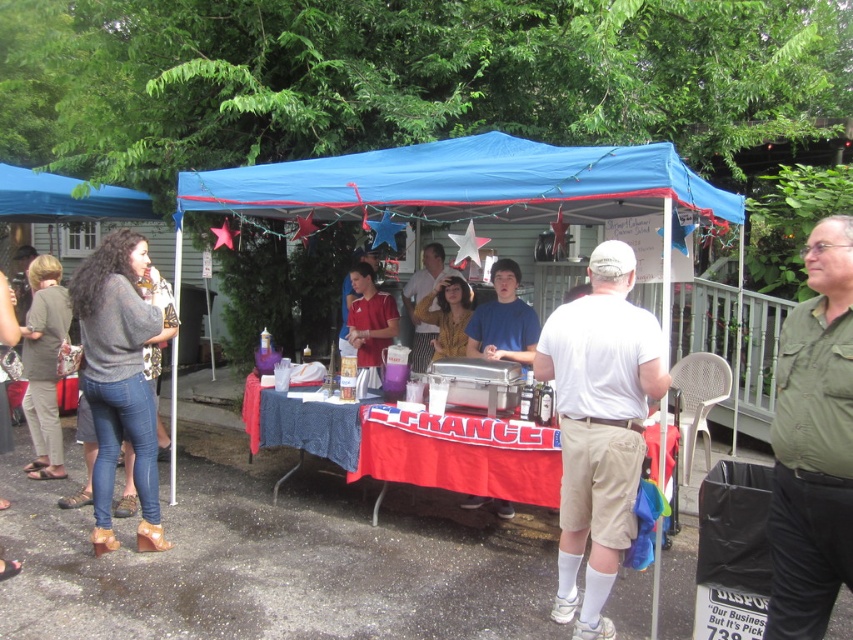
Looking at this image, what is located at the coordinates point (599, 426)?

The white cotton shirt at center is located at point (599, 426).

You are organizing a photo shoot at the event under the blue canopy tent. You need to place two shirts, the white cotton shirt at center and the green cotton shirt at center, on a display rack. Which shirt should you place on the higher shelf to ensure they are visible without overlapping?

The white cotton shirt at center is larger than the green cotton shirt at center, so placing the white cotton shirt at center on the higher shelf will prevent it from overlapping the smaller green cotton shirt at center below.

You are a photographer at the event and want to take a group photo of the white cotton shirt at center and the yellow striped shirt at center. The camera you have can capture a maximum distance of 3 meters between subjects. Will both people be in the frame?

The white cotton shirt at center and yellow striped shirt at center are 2.88 meters apart, which is within the camera maximum distance of 3 meters. Both people will be in the frame.